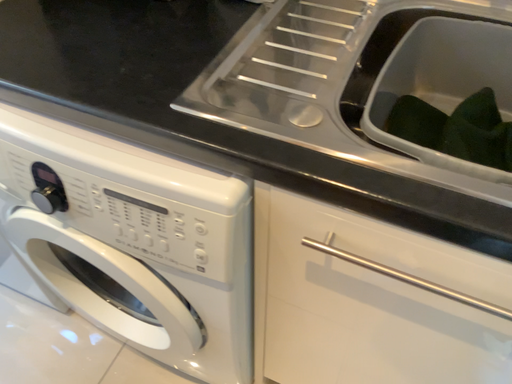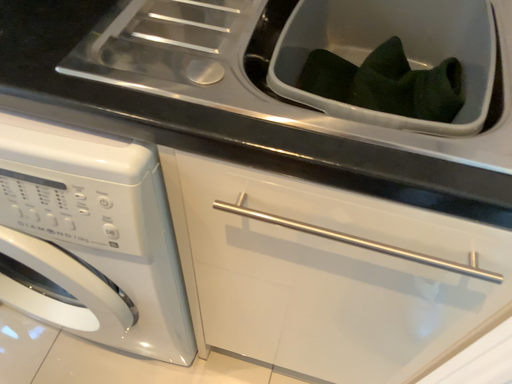
Question: How did the camera likely rotate when shooting the video?

Choices:
 (A) rotated left
 (B) rotated right

Answer: (B)